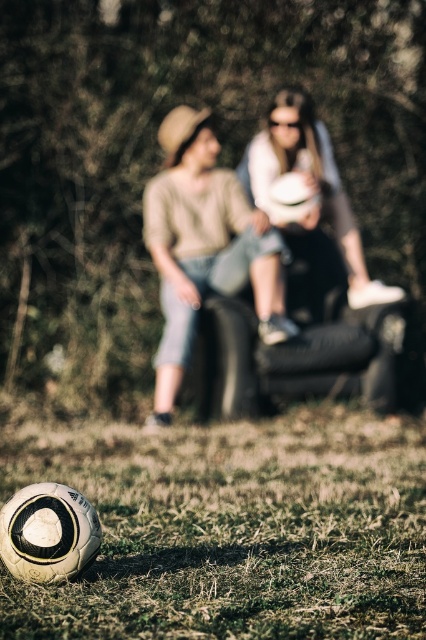
You are a photographer trying to capture a closeup of the matte white ball at center without the denim jeans at center blocking the view. Can you adjust your position to do so?

The denim jeans at center is in front of matte white ball at center, so moving the camera position slightly to the side or angle might allow you to frame the matte white ball at center without the denim jeans at center blocking it.

In the scene shown: You are standing 6 feet away from the camera. Can you reach the white matte soccer ball at lower left without moving?

The white matte soccer ball at lower left is 6.90 feet away from the camera. Since you are standing 6 feet away from the camera, you are 0.90 feet away from the ball, so yes, you can reach it without moving.

You are a photographer trying to capture a closeup of the white matte soccer ball at lower left and the denim jeans at center. Which object should you zoom in on to ensure the subject fills the frame without cropping?

The white matte soccer ball at lower left has a larger width than the denim jeans at center, so zooming in on the soccer ball would require more adjustment to avoid cropping, but since it is larger, it can fill the frame better without needing as much zoom. Alternatively, focusing on the denim jeans at center might necessitate closer proximity due to their smaller size.